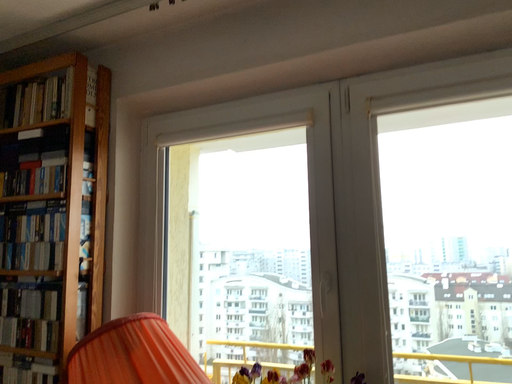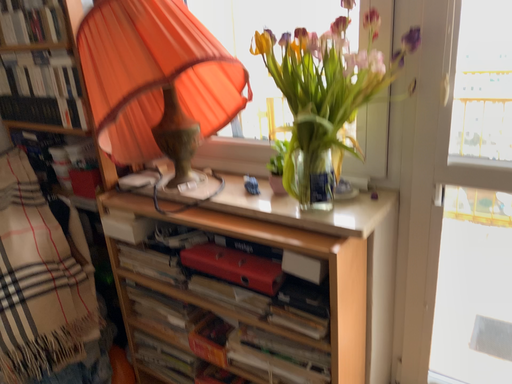
Question: How did the camera likely rotate when shooting the video?

Choices:
 (A) rotated right
 (B) rotated left

Answer: (B)